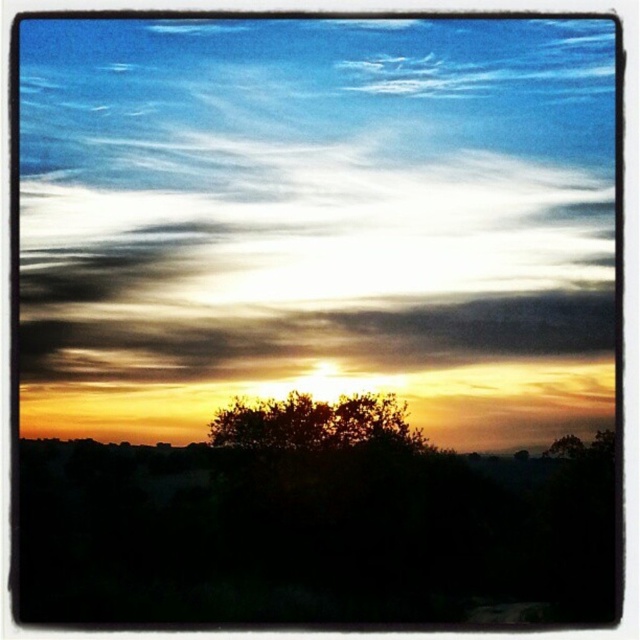
Question: Can you confirm if soft white clouds at upper center is positioned above dark green leafy tree at center?

Choices:
 (A) yes
 (B) no

Answer: (A)

Question: Which point is farther from the camera taking this photo?

Choices:
 (A) (522, 259)
 (B) (323, 422)

Answer: (A)

Question: Is soft white clouds at upper center further to camera compared to dark green leafy tree at center?

Choices:
 (A) yes
 (B) no

Answer: (B)

Question: Among these objects, which one is nearest to the camera?

Choices:
 (A) soft white clouds at upper center
 (B) dark green leafy tree at center

Answer: (A)

Question: Which of the following is the farthest from the observer?

Choices:
 (A) (106, 288)
 (B) (260, 404)

Answer: (B)

Question: Is soft white clouds at upper center bigger than dark green leafy tree at center?

Choices:
 (A) no
 (B) yes

Answer: (B)